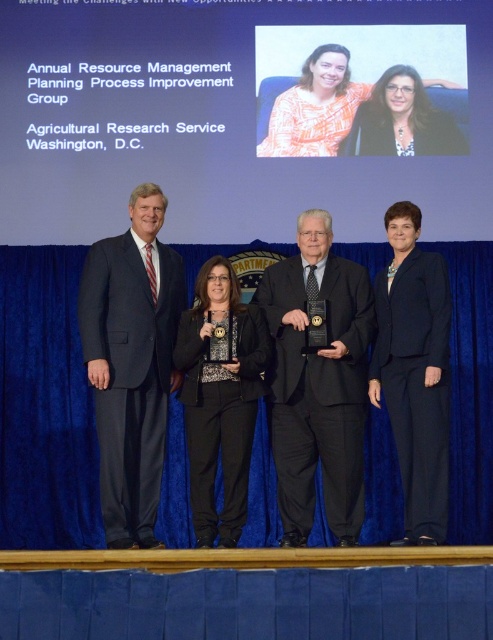
Which is behind, point (340, 413) or point (134, 257)?

The point (134, 257) is more distant.

Who is shorter, black matte suit at center or dark gray suit at left?

Standing shorter between the two is black matte suit at center.

Which is behind, point (297, 352) or point (112, 353)?

The point (297, 352) is behind.

The height and width of the screenshot is (640, 493). Identify the location of black matte suit at center. (317, 381).

Which is below, black textured pants at center or matte black blazer at center?

black textured pants at center is below.

Locate an element on the screen. black textured pants at center is located at coordinates (219, 400).

This screenshot has width=493, height=640. I want to click on black textured pants at center, so click(x=219, y=400).

The image size is (493, 640). What do you see at coordinates (219, 400) in the screenshot?
I see `black textured pants at center` at bounding box center [219, 400].

Who is shorter, black textured pants at center or orange printed blouse at center?

With less height is orange printed blouse at center.

Does point (250, 384) lie in front of point (399, 148)?

Yes, point (250, 384) is in front of point (399, 148).

At what (x,y) coordinates should I click in order to perform the action: click on black textured pants at center. Please return your answer as a coordinate pair (x, y). The image size is (493, 640). Looking at the image, I should click on (219, 400).